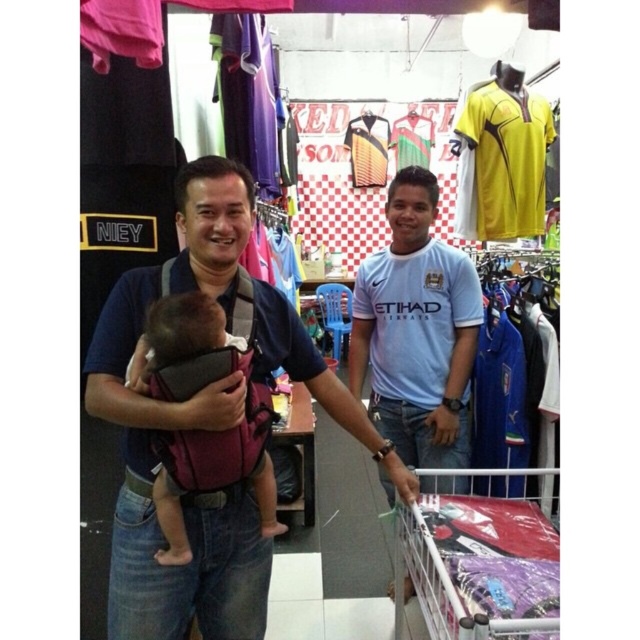
Question: Which of the following is the farthest from the observer?

Choices:
 (A) (193, 445)
 (B) (125, 497)

Answer: (B)

Question: Which point is farther to the camera?

Choices:
 (A) (465, 266)
 (B) (163, 349)

Answer: (A)

Question: Is light blue jersey at center below dark purple fabric carrier at center?

Choices:
 (A) no
 (B) yes

Answer: (A)

Question: Does metallic silver cart at lower right have a lesser width compared to dark purple fabric carrier at center?

Choices:
 (A) yes
 (B) no

Answer: (B)

Question: Does light blue jersey at center come in front of metallic silver cart at lower right?

Choices:
 (A) yes
 (B) no

Answer: (B)

Question: Which point is farther to the camera?

Choices:
 (A) (532, 557)
 (B) (432, 176)
 (C) (198, 262)
 (D) (252, 385)

Answer: (B)